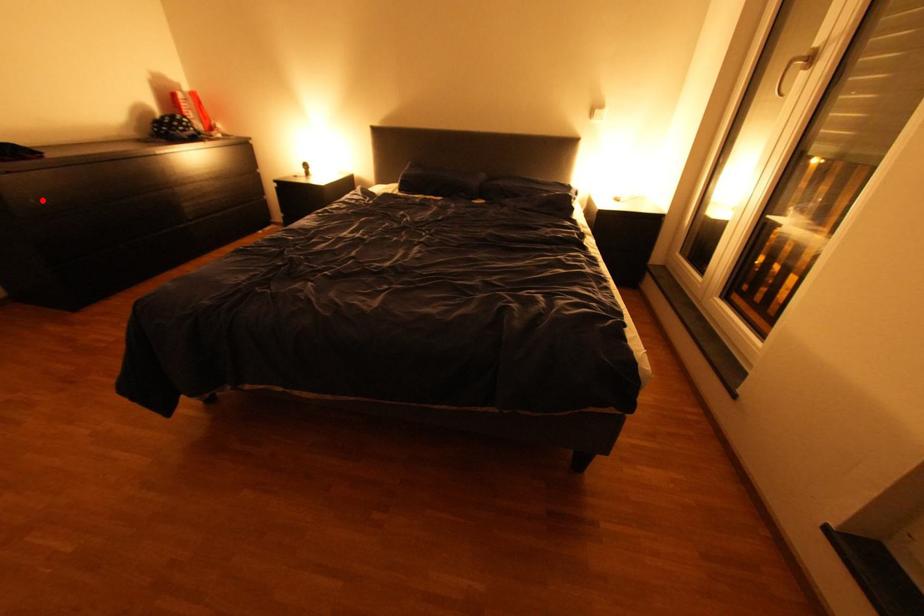
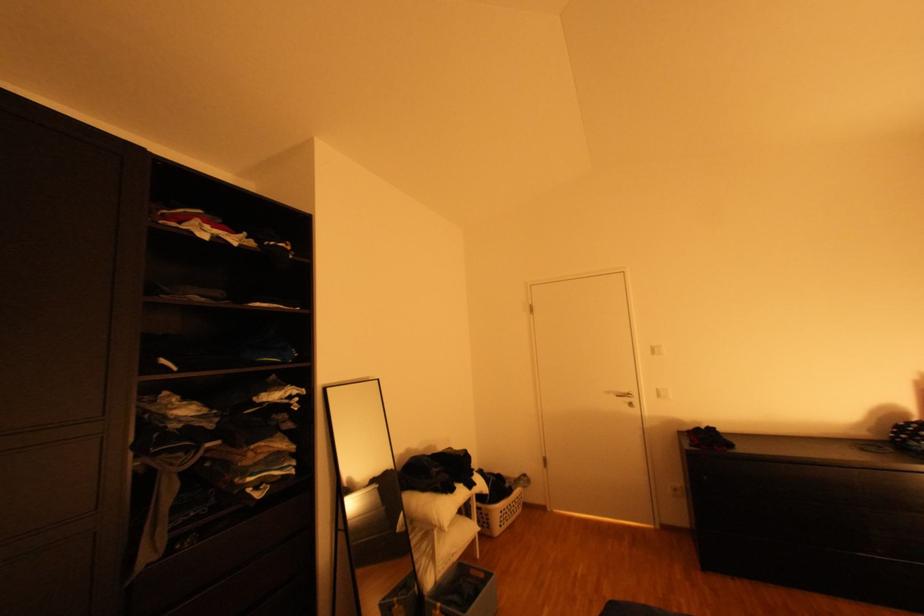
The point at the highlighted location is marked in the first image. Where is the corresponding point in the second image?

(715, 477)